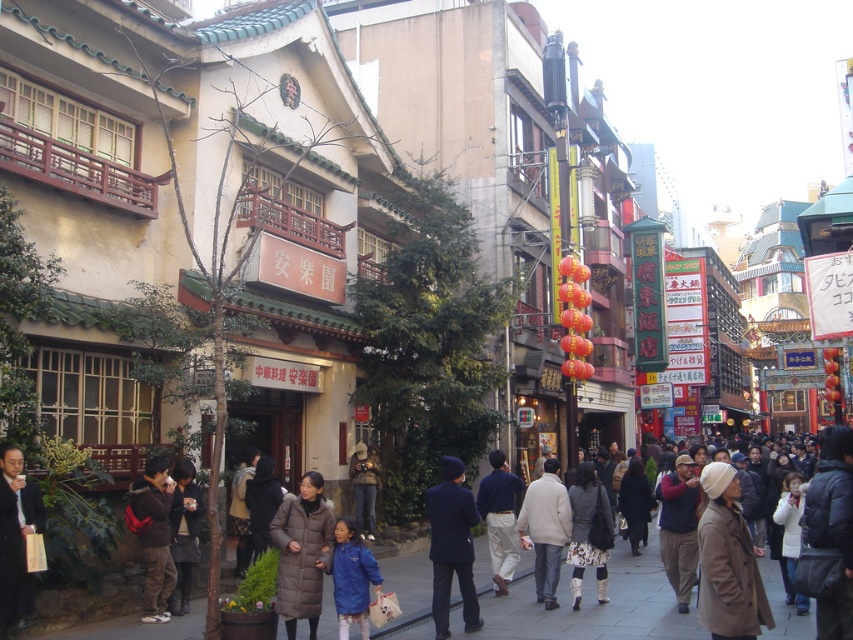
The image size is (853, 640). Describe the element at coordinates (679, 528) in the screenshot. I see `dark blue jacket at center` at that location.

Does point (695, 563) come in front of point (368, 456)?

Yes, point (695, 563) is in front of point (368, 456).

Where is `dark blue jacket at center`? Image resolution: width=853 pixels, height=640 pixels. dark blue jacket at center is located at coordinates (679, 528).

Does navy blue suit at center come in front of white textured pants at center?

That is True.

Is navy blue suit at center thinner than white textured pants at center?

In fact, navy blue suit at center might be wider than white textured pants at center.

Is point (440, 554) positioned behind point (593, 484)?

No, it is not.

The image size is (853, 640). I want to click on navy blue suit at center, so click(451, 545).

Can you confirm if blue matte jacket at lower center is thinner than light blue cotton shirt at center?

Correct, blue matte jacket at lower center's width is less than light blue cotton shirt at center's.

Between blue matte jacket at lower center and light blue cotton shirt at center, which one has more height?

Standing taller between the two is light blue cotton shirt at center.

Is point (360, 545) positioned behind point (496, 474)?

No, it is in front of (496, 474).

Find the location of a particular element. blue matte jacket at lower center is located at coordinates (352, 577).